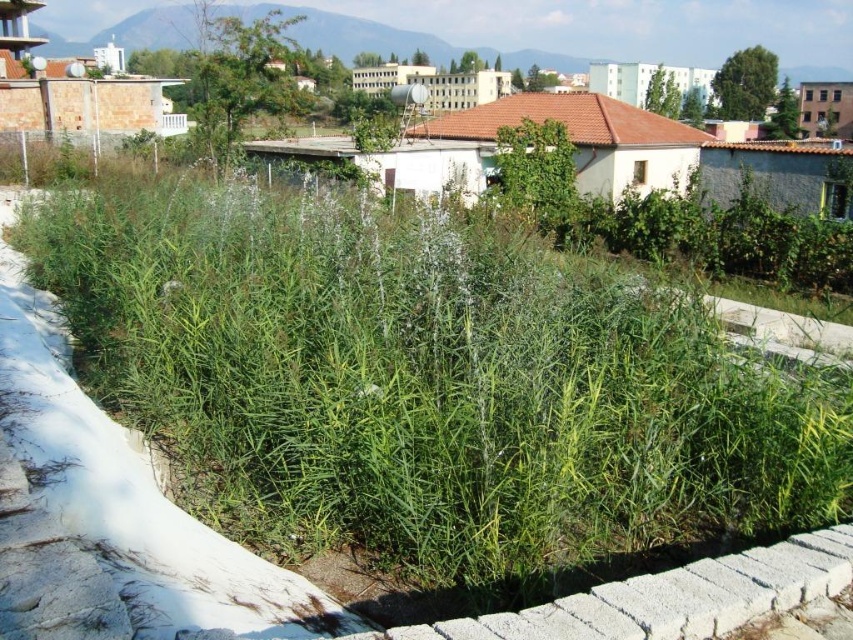
Who is more distant from viewer, (244, 204) or (514, 58)?

The point (514, 58) is more distant.

Does green leafy grass at center appear over green grass at upper center?

Incorrect, green leafy grass at center is not positioned above green grass at upper center.

The image size is (853, 640). What are the coordinates of `green leafy grass at center` in the screenshot? It's located at (428, 385).